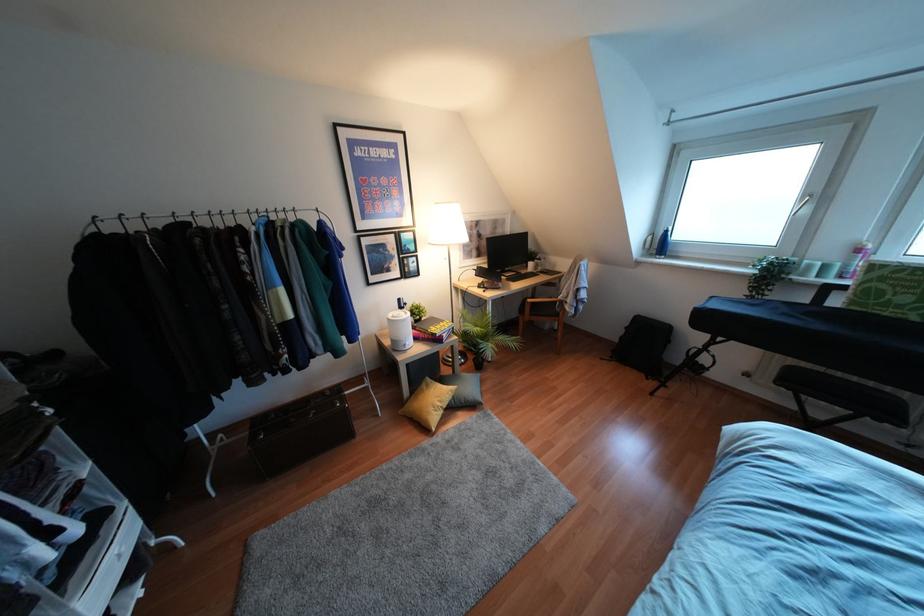
What do you see at coordinates (662, 243) in the screenshot? I see `a blue water bottle` at bounding box center [662, 243].